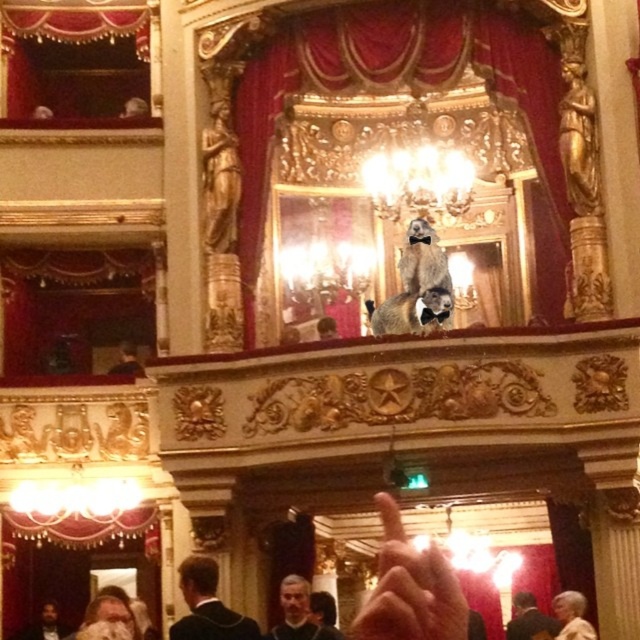
Question: Does red velvet curtain at center appear on the left side of dark brown suit at lower left?

Choices:
 (A) yes
 (B) no

Answer: (B)

Question: Based on their relative distances, which object is nearer to the flesh-toned skin at center?

Choices:
 (A) red velvet curtain at center
 (B) dark brown suit at lower left
 (C) gray hair at center
 (D) dark suit at center

Answer: (C)

Question: Which point appears closest to the camera in this image?

Choices:
 (A) (54, 636)
 (B) (541, 627)
 (C) (385, 612)
 (D) (298, 60)

Answer: (C)

Question: Can you confirm if red velvet curtain at center is positioned to the right of dark brown suit at lower left?

Choices:
 (A) no
 (B) yes

Answer: (B)

Question: Among these points, which one is nearest to the camera?

Choices:
 (A) click(243, 637)
 (B) click(536, 624)

Answer: (A)

Question: Is flesh-toned skin at center to the left of gray hair at center from the viewer's perspective?

Choices:
 (A) yes
 (B) no

Answer: (B)